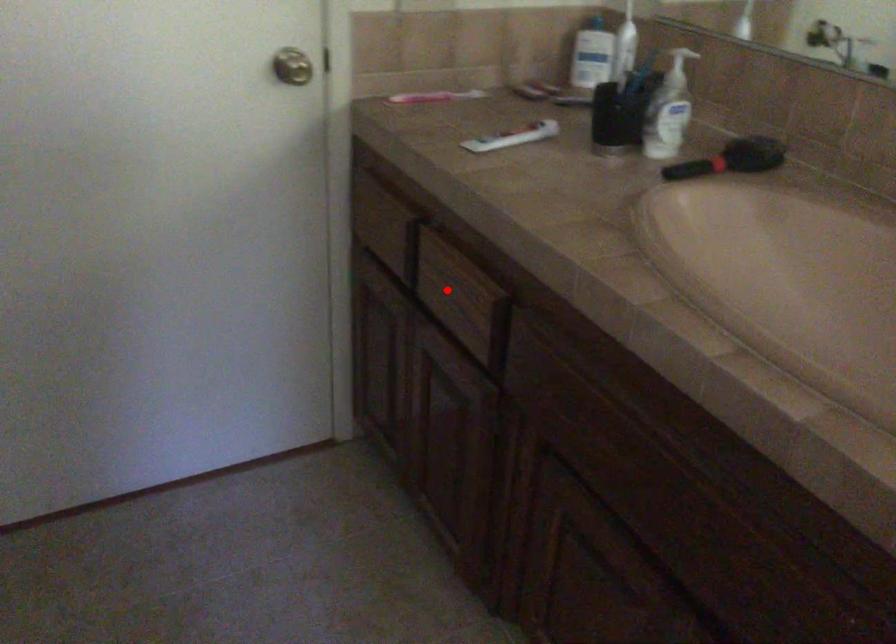
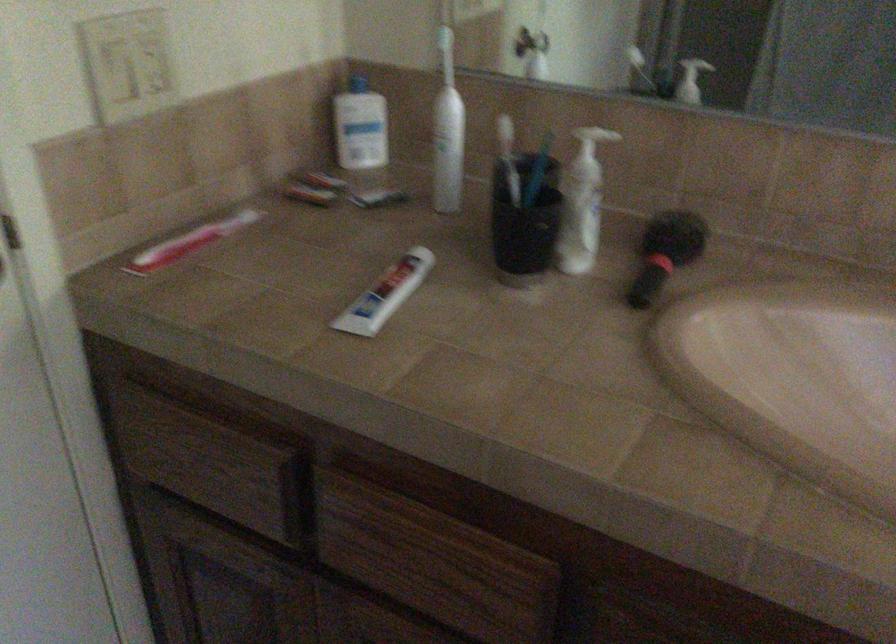
In the second image, find the point that corresponds to the highlighted location in the first image.

(410, 560)